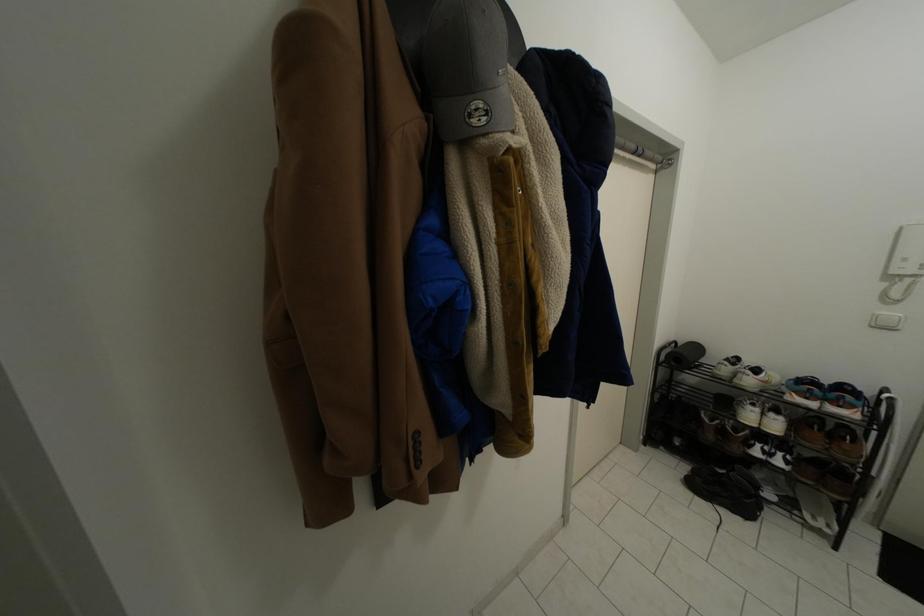
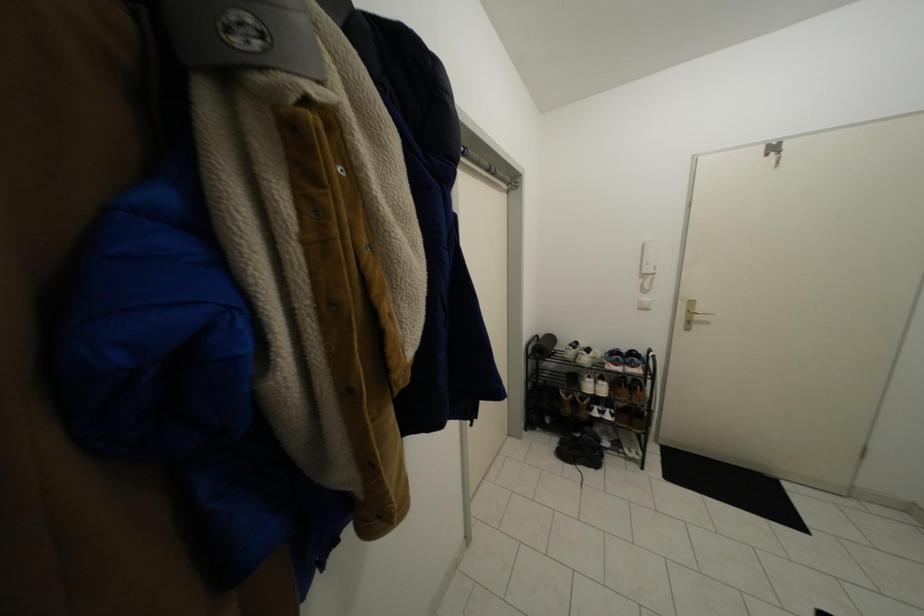
Question: The camera is either moving clockwise (left) or counter-clockwise (right) around the object. The first image is from the beginning of the video and the second image is from the end. Is the camera moving left or right when shooting the video?

Choices:
 (A) Left
 (B) Right

Answer: (A)